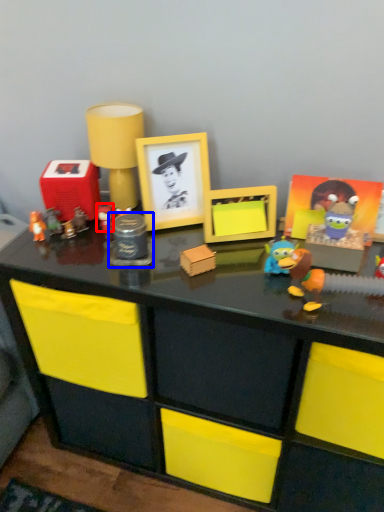
Question: Which of the following is the closest to the observer, toy (highlighted by a red box) or toy (highlighted by a blue box)?

Choices:
 (A) toy
 (B) toy

Answer: (B)